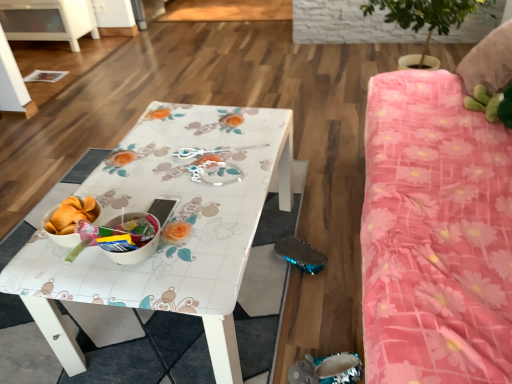
Find the location of a particular element. free point behind pink floral fabric bed at right is located at coordinates (311, 135).